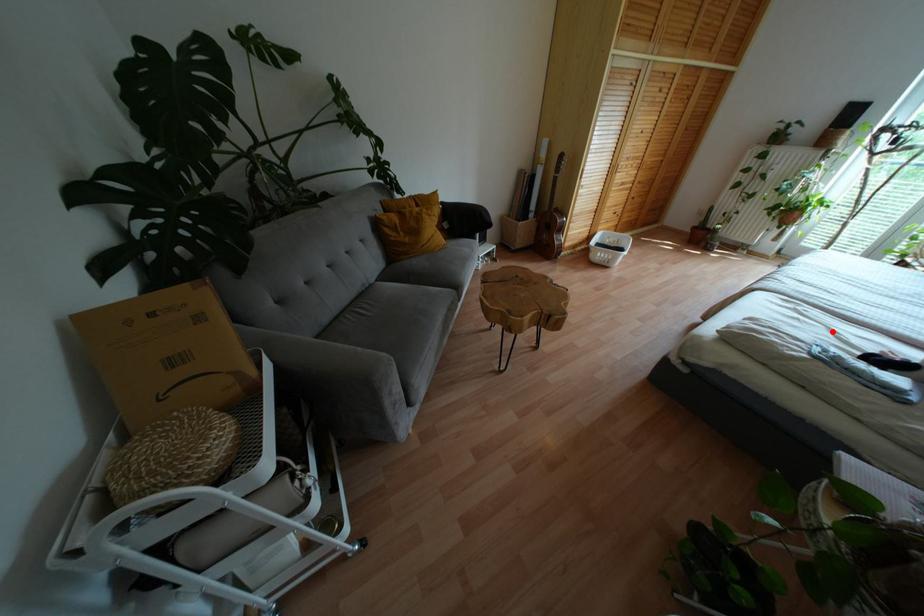
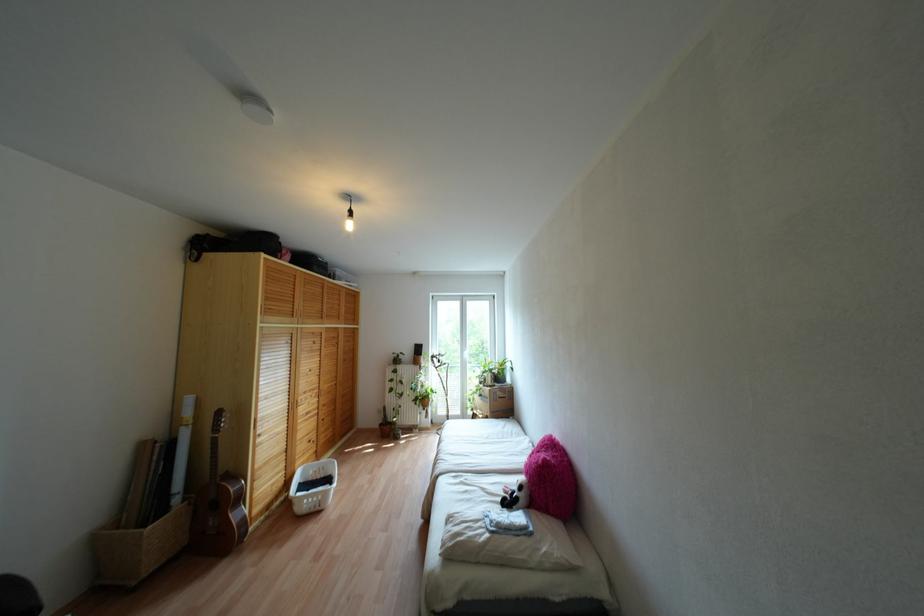
The point at the highlighted location is marked in the first image. Where is the corresponding point in the second image?

(482, 488)